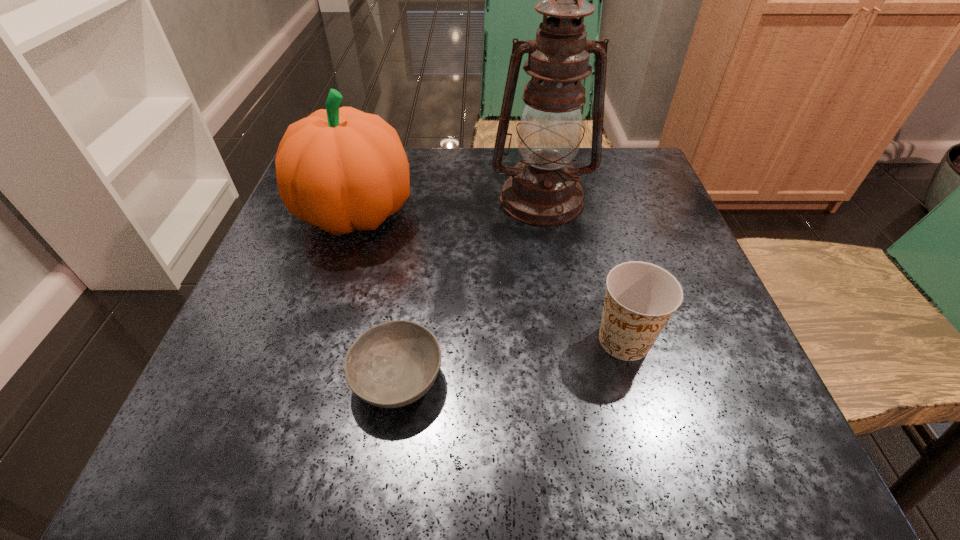
What are the coordinates of `object positioned at the near edge` in the screenshot? It's located at (393, 364).

You are a GUI agent. You are given a task and a screenshot of the screen. Output one action in this format:
    pyautogui.click(x=<x>, y=<y>)
    Task: Click on the object positioned at the left edge
    The image size is (960, 540).
    Given the screenshot: What is the action you would take?
    pyautogui.click(x=340, y=169)

What are the coordinates of `oil lamp present at the right edge` in the screenshot? It's located at (543, 190).

Identify the location of Dixie cup that is at the right edge. This screenshot has height=540, width=960. (641, 297).

Where is `object present at the far left corner`? The width and height of the screenshot is (960, 540). object present at the far left corner is located at coordinates (340, 169).

The width and height of the screenshot is (960, 540). I want to click on object that is at the far right corner, so click(x=543, y=190).

What are the coordinates of `free space at the far edge of the desktop` in the screenshot? It's located at (412, 190).

In the image, there is a desktop. Where is `vacant space at the left edge`? The height and width of the screenshot is (540, 960). vacant space at the left edge is located at coordinates (317, 391).

At what (x,y) coordinates should I click in order to perform the action: click on vacant space at the right edge of the desktop. Please return your answer as a coordinate pair (x, y). The height and width of the screenshot is (540, 960). Looking at the image, I should click on (618, 228).

Find the location of a particular element. The image size is (960, 540). vacant space at the near left corner of the desktop is located at coordinates (305, 446).